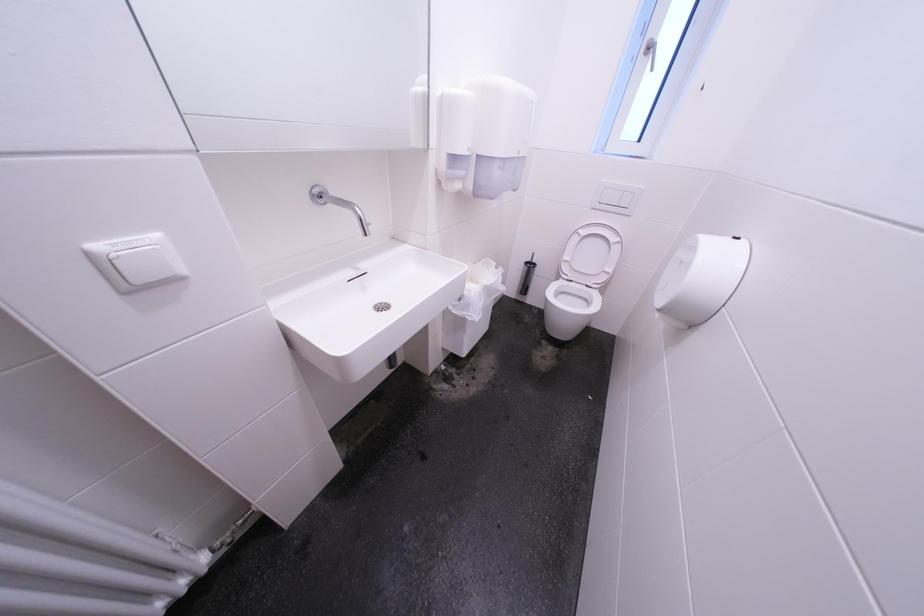
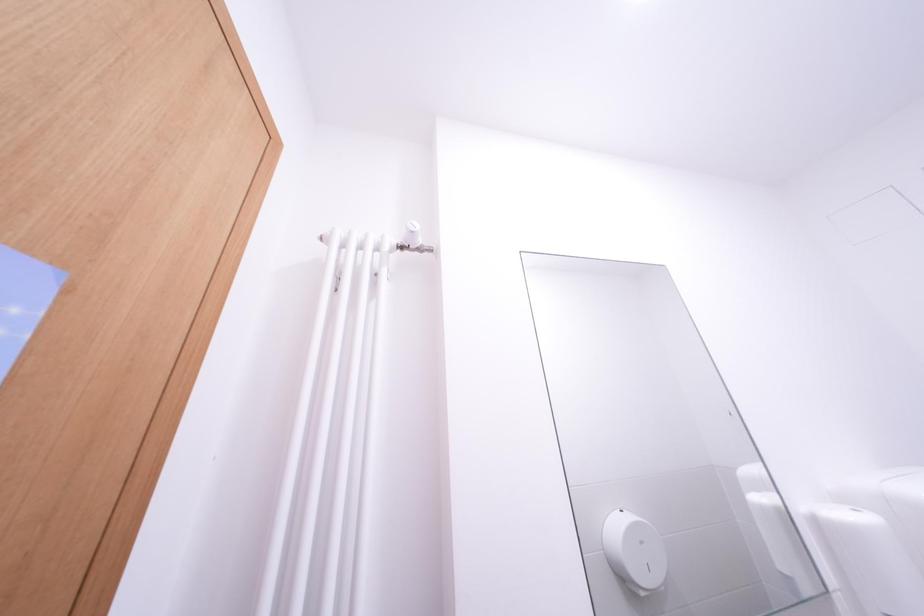
First-person continuous shooting, in which direction is the camera rotating?

The camera rotated toward left-up.